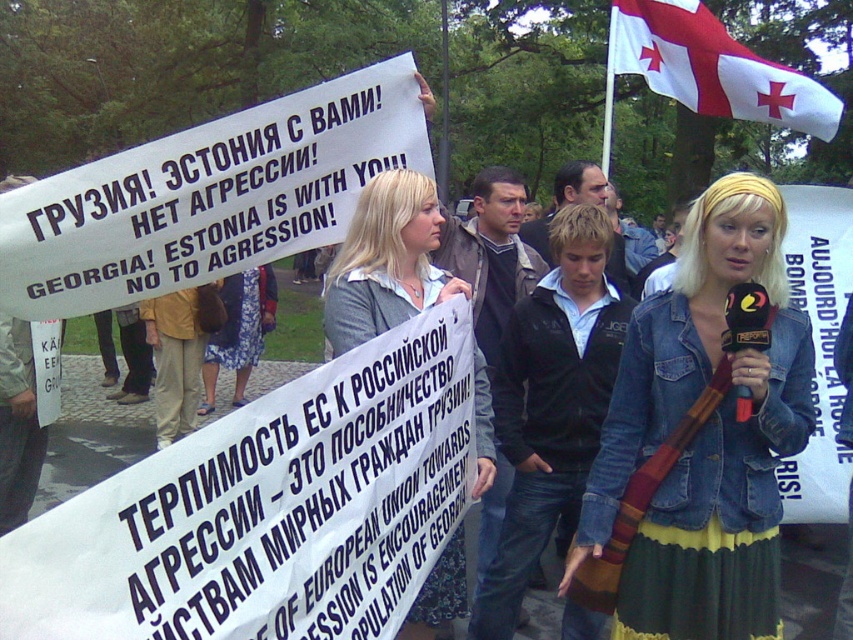
Does denim jacket at lower right have a larger size compared to white fabric flag at upper right?

Actually, denim jacket at lower right might be smaller than white fabric flag at upper right.

Can you confirm if denim jacket at lower right is positioned below white fabric flag at upper right?

Yes, denim jacket at lower right is below white fabric flag at upper right.

Who is more distant from viewer, (688, 525) or (811, 106)?

Positioned behind is point (811, 106).

Where is `denim jacket at lower right`? denim jacket at lower right is located at coordinates [704, 433].

Between point (705, 196) and point (325, 308), which one is positioned in front?

Point (705, 196) is in front.

What do you see at coordinates (704, 433) in the screenshot? I see `denim jacket at lower right` at bounding box center [704, 433].

Which is in front, point (772, 321) or point (402, 264)?

Point (772, 321) is in front.

At what (x,y) coordinates should I click in order to perform the action: click on denim jacket at lower right. Please return your answer as a coordinate pair (x, y). The width and height of the screenshot is (853, 640). Looking at the image, I should click on (704, 433).

Who is higher up, dark blue jacket at center or blonde hair at center?

dark blue jacket at center is above.

Is dark blue jacket at center to the left of blonde hair at center from the viewer's perspective?

No, dark blue jacket at center is not to the left of blonde hair at center.

The image size is (853, 640). Describe the element at coordinates (550, 403) in the screenshot. I see `dark blue jacket at center` at that location.

You are a GUI agent. You are given a task and a screenshot of the screen. Output one action in this format:
    pyautogui.click(x=<x>, y=<y>)
    Task: Click on the dark blue jacket at center
    The width and height of the screenshot is (853, 640).
    Given the screenshot: What is the action you would take?
    pyautogui.click(x=550, y=403)